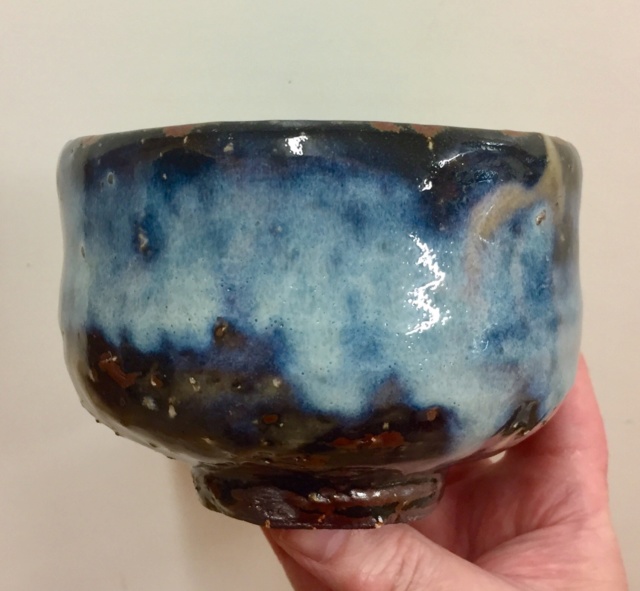
The width and height of the screenshot is (640, 591). In order to click on bowl in this screenshot , I will do `click(411, 288)`.